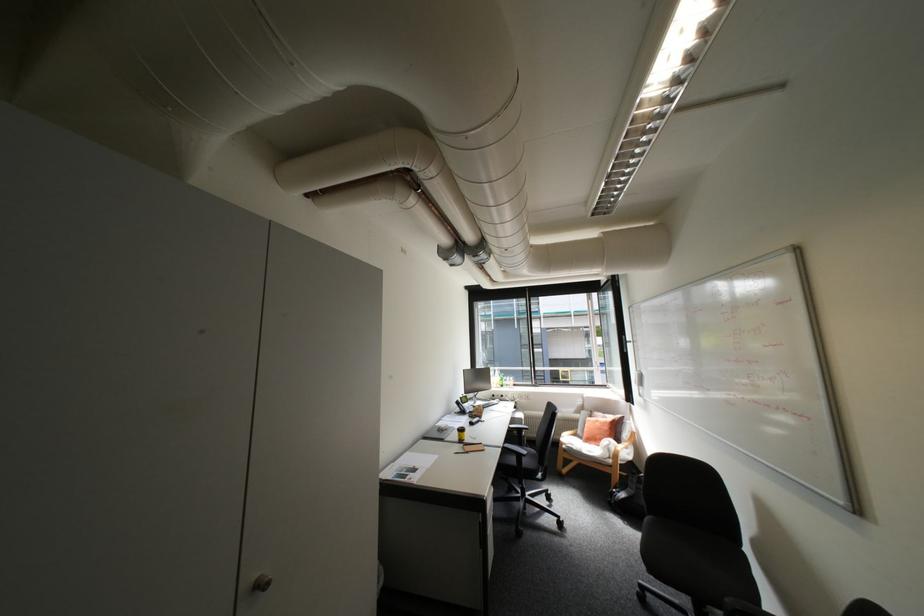
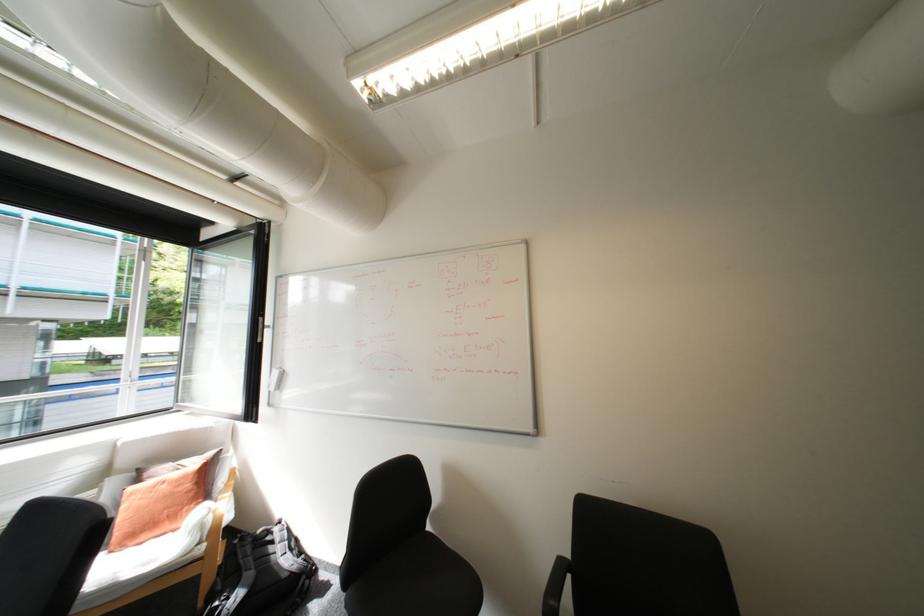
Locate, in the second image, the point that corresponds to point 608,423 in the first image.

(175, 485)